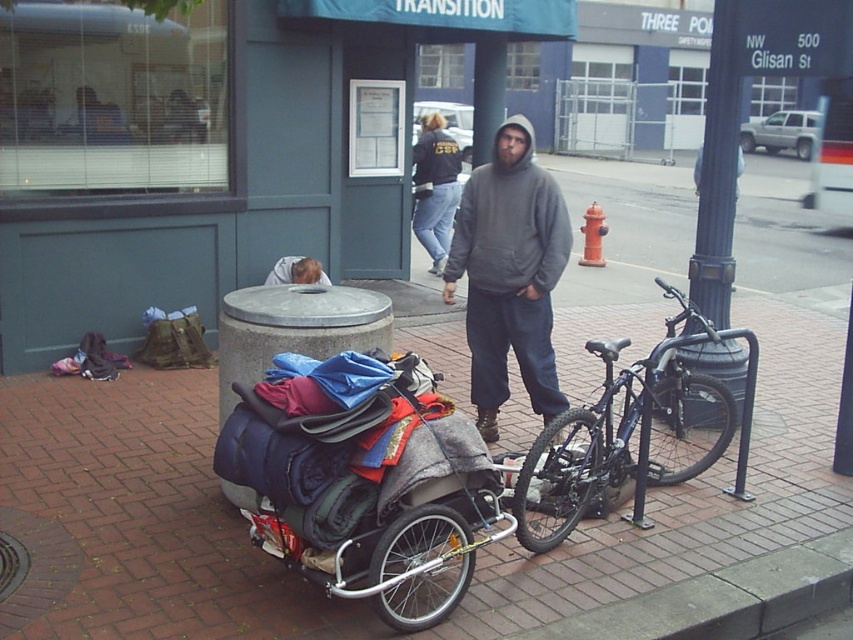
Question: Is blue fabric-covered cart at center smaller than dark blue jeans at center?

Choices:
 (A) yes
 (B) no

Answer: (B)

Question: Can you confirm if brick at lower right is bigger than blue fabric sleeping bag at lower left?

Choices:
 (A) yes
 (B) no

Answer: (A)

Question: Based on their relative distances, which object is nearer to the blue fabric sleeping bag at lower left?

Choices:
 (A) gray hoodie at center
 (B) brick at lower right
 (C) black metal pole at right
 (D) blue fabric-covered cart at center

Answer: (A)

Question: Does gray hoodie at center have a greater width compared to dark blue jeans at center?

Choices:
 (A) no
 (B) yes

Answer: (B)

Question: Which object is closer to the camera taking this photo?

Choices:
 (A) shiny blue bike at center
 (B) brick at lower right
 (C) brick pavement at center

Answer: (C)

Question: Which point is closer to the camera taking this photo?

Choices:
 (A) (357, 554)
 (B) (438, 257)
 (C) (120, 392)

Answer: (A)